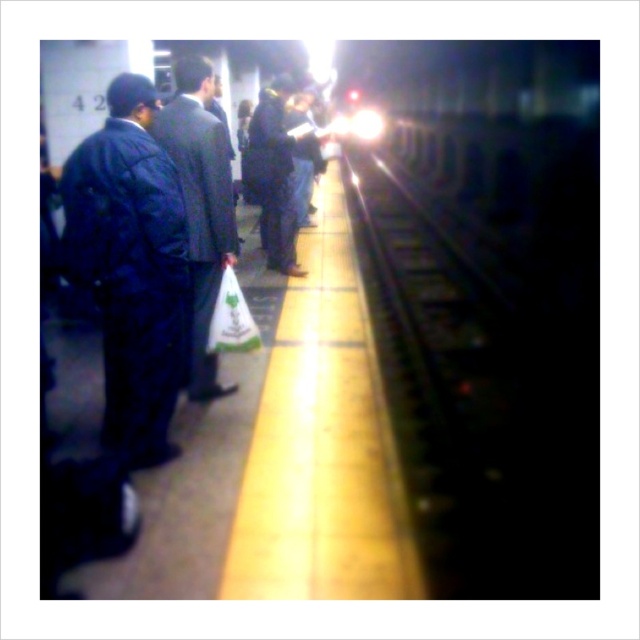
You are standing on the subway platform and want to reach the yellow tactile paving strip at the edge. Given that the point closest to you is at coordinate point (x=182, y=195), which is 2.94 meters away from you, can you safely step onto the paving strip without overstepping the platform edge?

Yes, you can safely step onto the yellow tactile paving strip because the distance from your current position to the point at (x=182, y=195) is 2.94 meters, which is sufficient to reach the edge without overstepping.

You are a person waiting for the subway. You see a dark blue jacket at left and a dark blue jeans at center. Which one is closer to you?

The dark blue jacket at left is closer to you because it is in front of the dark blue jeans at center.